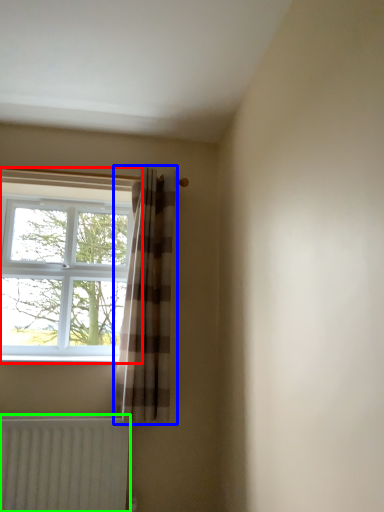
Question: Estimate the real-world distances between objects in this image. Which object is farther from window (highlighted by a red box), curtain (highlighted by a blue box) or radiator (highlighted by a green box)?

Choices:
 (A) curtain
 (B) radiator

Answer: (B)